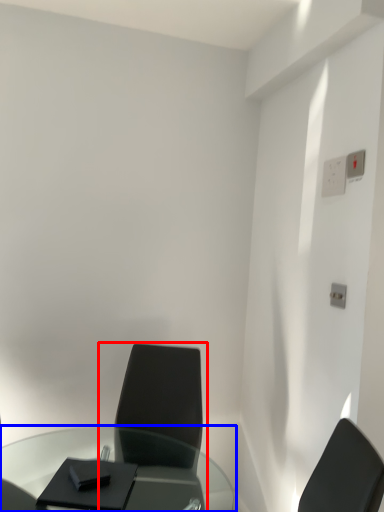
Question: Which point is closer to the camera, chair (highlighted by a red box) or table (highlighted by a blue box)?

Choices:
 (A) chair
 (B) table

Answer: (B)